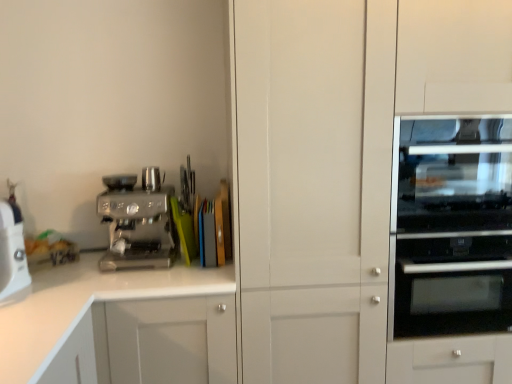
Question: From a real-world perspective, is white glossy cabinet at lower left positioned above or below satin chrome espresso machine at left?

Choices:
 (A) above
 (B) below

Answer: (B)

Question: Considering the positions of point tap(94, 256) and point tap(120, 200), is point tap(94, 256) closer or farther from the camera than point tap(120, 200)?

Choices:
 (A) farther
 (B) closer

Answer: (A)

Question: Which object is the farthest from the white glossy cabinet at lower left?

Choices:
 (A) transparent glass oven at right
 (B) white plastic food processor at left
 (C) satin chrome espresso machine at left
 (D) black glass oven at right

Answer: (D)

Question: Which of these objects is positioned farthest from the transparent glass oven at right?

Choices:
 (A) satin chrome espresso machine at left
 (B) white glossy cabinet at lower left
 (C) white plastic food processor at left
 (D) black glass oven at right

Answer: (C)